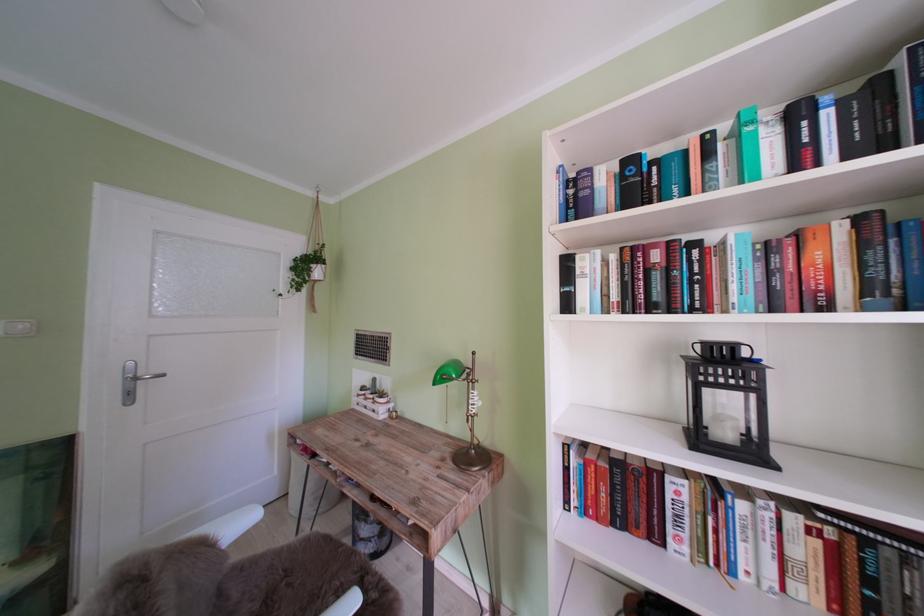
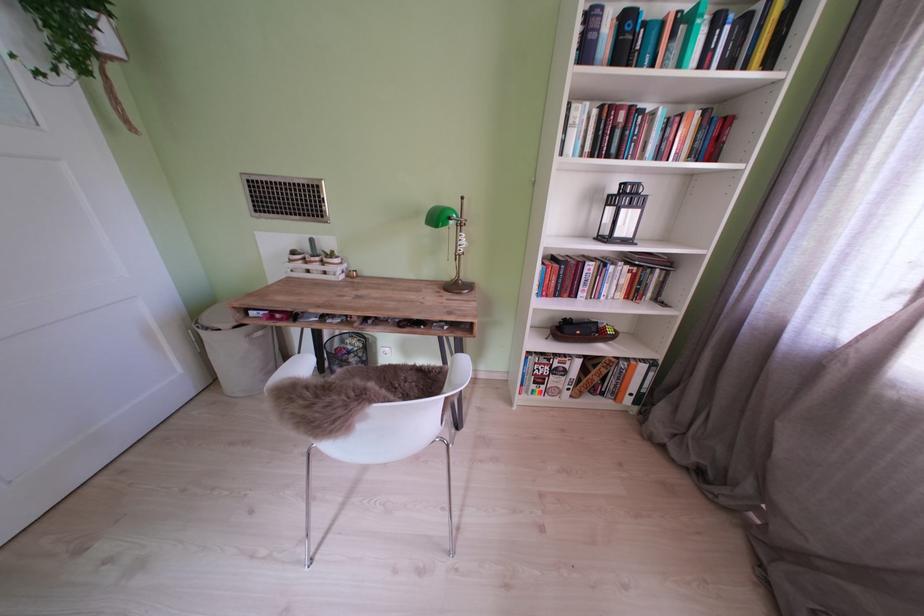
From the picture: The images are taken continuously from a first-person perspective. In which direction is your viewpoint rotating?

The rotation direction of the camera is right-down.